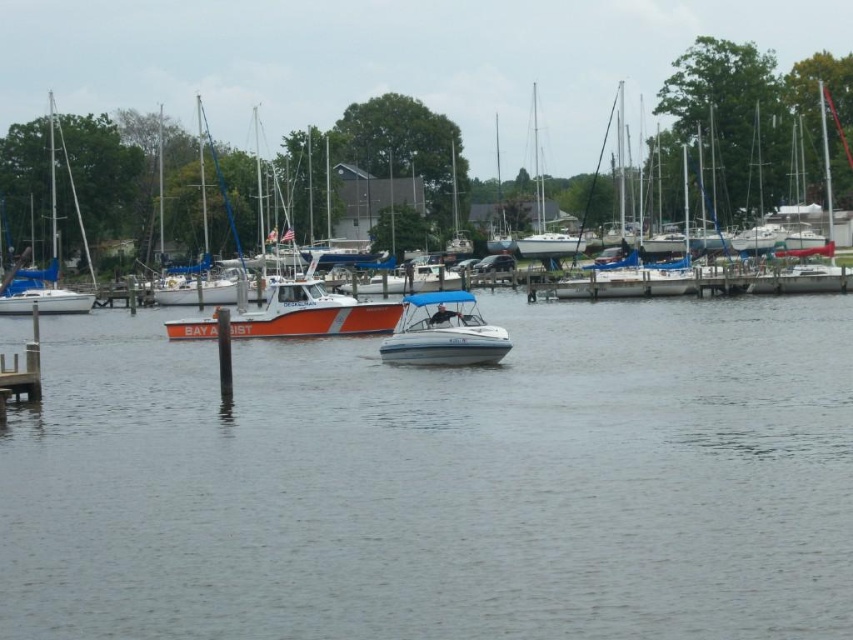
Question: Observing the image, what is the correct spatial positioning of clear water at center in reference to white plastic boat at center?

Choices:
 (A) left
 (B) right

Answer: (A)

Question: Which of the following is the closest to the observer?

Choices:
 (A) (653, 156)
 (B) (440, 339)

Answer: (B)

Question: Does clear water at center have a smaller size compared to white matte boat at center?

Choices:
 (A) yes
 (B) no

Answer: (B)

Question: Which of the following is the farthest from the observer?

Choices:
 (A) white plastic boat at center
 (B) clear water at center
 (C) blue sailboat at left

Answer: (C)

Question: Does clear water at center have a larger size compared to white plastic boat at center?

Choices:
 (A) yes
 (B) no

Answer: (B)

Question: Which of the following is the farthest from the observer?

Choices:
 (A) (827, 368)
 (B) (456, 305)
 (C) (16, 172)
 (D) (13, 314)

Answer: (C)